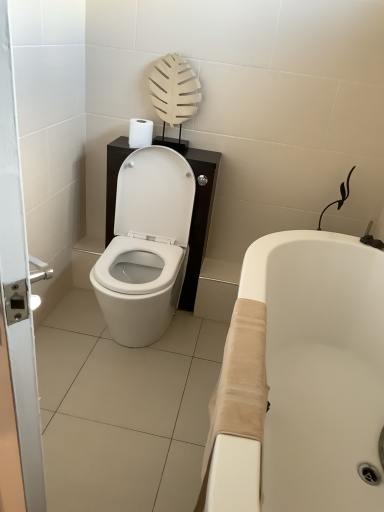
Where is `white matte toilet paper at upper center`? The image size is (384, 512). white matte toilet paper at upper center is located at coordinates (140, 133).

You are a GUI agent. You are given a task and a screenshot of the screen. Output one action in this format:
    pyautogui.click(x=<x>, y=<y>)
    Task: Click on the beige fabric bathtub at lower right
    
    Given the screenshot: What is the action you would take?
    pyautogui.click(x=320, y=366)

What do you see at coordinates (320, 366) in the screenshot?
I see `beige fabric bathtub at lower right` at bounding box center [320, 366].

Describe the element at coordinates (146, 246) in the screenshot. I see `white glossy toilet at center` at that location.

This screenshot has width=384, height=512. What do you see at coordinates (15, 283) in the screenshot? I see `white glossy door at left` at bounding box center [15, 283].

Locate an element on the screen. This screenshot has width=384, height=512. white matte toilet paper at upper center is located at coordinates (140, 133).

From the picture: Is white glossy door at left inside white matte toilet paper at upper center?

Definitely not — white glossy door at left is not inside white matte toilet paper at upper center.

Which of these two, white matte toilet paper at upper center or white glossy door at left, is bigger?

Bigger between the two is white glossy door at left.

Considering the positions of objects white matte toilet paper at upper center and white glossy door at left in the image provided, who is more to the left, white matte toilet paper at upper center or white glossy door at left?

white glossy door at left is more to the left.

From the image's perspective, is white glossy toilet at center beneath beige fabric bathtub at lower right?

No.

Is white glossy toilet at center in contact with beige fabric bathtub at lower right?

No, white glossy toilet at center is not next to beige fabric bathtub at lower right.

Considering the relative positions of white glossy toilet at center and beige fabric bathtub at lower right in the image provided, is white glossy toilet at center in front of beige fabric bathtub at lower right?

That is False.

Locate an element on the screen. The width and height of the screenshot is (384, 512). bath located below the white glossy toilet at center (from the image's perspective) is located at coordinates (320, 366).

Is white matte toilet paper at upper center turned away from beige fabric bathtub at lower right?

white matte toilet paper at upper center is not turned away from beige fabric bathtub at lower right.

What's the angular difference between white matte toilet paper at upper center and beige fabric bathtub at lower right's facing directions?

They differ by 92.9 degrees in their facing directions.

Between point (146, 138) and point (336, 328), which one is positioned in front?

The point (336, 328) is in front.

Is white matte toilet paper at upper center inside the boundaries of beige fabric bathtub at lower right, or outside?

white matte toilet paper at upper center is spatially situated outside beige fabric bathtub at lower right.

Locate an element on the screen. The height and width of the screenshot is (512, 384). toilet paper behind the white glossy toilet at center is located at coordinates (140, 133).

From the image's perspective, which is below, white matte toilet paper at upper center or white glossy toilet at center?

white glossy toilet at center, from the image's perspective.

Between white matte toilet paper at upper center and white glossy toilet at center, which one has larger width?

With larger width is white glossy toilet at center.

From a real-world perspective, is white glossy toilet at center positioned above or below white matte toilet paper at upper center?

In terms of real-world spatial position, white glossy toilet at center is below white matte toilet paper at upper center.

Can you tell me how much white glossy toilet at center and white matte toilet paper at upper center differ in facing direction?

The facing directions of white glossy toilet at center and white matte toilet paper at upper center are 2.72 degrees apart.

Are white glossy toilet at center and white matte toilet paper at upper center beside each other?

No, white glossy toilet at center is not touching white matte toilet paper at upper center.

Looking at this image, from the image's perspective, which is above, beige fabric bathtub at lower right or white glossy toilet at center?

From the image's view, white glossy toilet at center is above.

Is beige fabric bathtub at lower right oriented towards white glossy toilet at center?

Yes, beige fabric bathtub at lower right is facing white glossy toilet at center.

Which point is more forward, (x=292, y=454) or (x=158, y=275)?

Positioned in front is point (x=292, y=454).

Does point (313, 489) appear closer or farther from the camera than point (17, 441)?

Point (313, 489) appears to be farther away from the viewer than point (17, 441).

From the image's perspective, is beige fabric bathtub at lower right below white glossy door at left?

Yes.

Which object is wider, beige fabric bathtub at lower right or white glossy door at left?

beige fabric bathtub at lower right.

What's the angular difference between beige fabric bathtub at lower right and white glossy door at left's facing directions?

The angle between the facing direction of beige fabric bathtub at lower right and the facing direction of white glossy door at left is 54.6 degrees.

Identify the location of screen door lying in front of the white matte toilet paper at upper center. The width and height of the screenshot is (384, 512). (15, 283).

Where is `bath below the white glossy toilet at center (from the image's perspective)`? The height and width of the screenshot is (512, 384). bath below the white glossy toilet at center (from the image's perspective) is located at coordinates (320, 366).

Looking at this image, looking at the image, which one is located further to white glossy toilet at center, white matte toilet paper at upper center or beige fabric bathtub at lower right?

beige fabric bathtub at lower right.

Estimate the real-world distances between objects in this image. Which object is closer to white glossy door at left, white matte toilet paper at upper center or beige fabric bathtub at lower right?

beige fabric bathtub at lower right is closer to white glossy door at left.

Considering their positions, is beige fabric bathtub at lower right positioned closer to white matte toilet paper at upper center than white glossy door at left?

Based on the image, beige fabric bathtub at lower right appears to be nearer to white matte toilet paper at upper center.

Estimate the real-world distances between objects in this image. Which object is closer to white glossy door at left, beige fabric bathtub at lower right or white glossy toilet at center?

Among the two, beige fabric bathtub at lower right is located nearer to white glossy door at left.

Which object lies further to the anchor point white matte toilet paper at upper center, white glossy door at left or beige fabric bathtub at lower right?

white glossy door at left.

Looking at the image, which one is located further to beige fabric bathtub at lower right, white glossy door at left or white glossy toilet at center?

white glossy door at left is further to beige fabric bathtub at lower right.

When comparing their distances from beige fabric bathtub at lower right, does white glossy toilet at center or white matte toilet paper at upper center seem closer?

The object closer to beige fabric bathtub at lower right is white glossy toilet at center.

Considering their positions, is beige fabric bathtub at lower right positioned closer to white glossy toilet at center than white glossy door at left?

The object closer to white glossy toilet at center is beige fabric bathtub at lower right.

Image resolution: width=384 pixels, height=512 pixels. Identify the location of toilet between white glossy door at left and white matte toilet paper at upper center from front to back. (146, 246).

Find the location of a particular element. Image resolution: width=384 pixels, height=512 pixels. bath located between white glossy door at left and white matte toilet paper at upper center in the depth direction is located at coordinates (320, 366).

Where is `toilet between beige fabric bathtub at lower right and white matte toilet paper at upper center along the z-axis`? toilet between beige fabric bathtub at lower right and white matte toilet paper at upper center along the z-axis is located at coordinates (146, 246).

Locate an element on the screen. This screenshot has width=384, height=512. bath between white glossy door at left and white glossy toilet at center in the front-back direction is located at coordinates (320, 366).